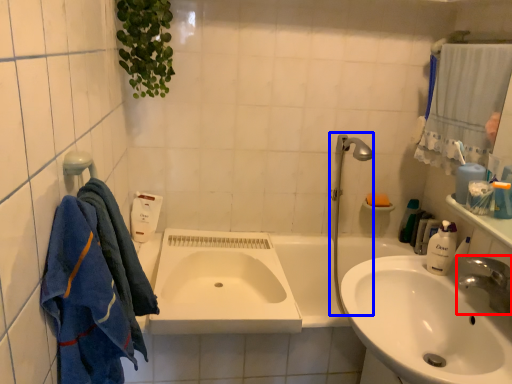
Question: Which object is further to the camera taking this photo, tap (highlighted by a red box) or plumbing fixture (highlighted by a blue box)?

Choices:
 (A) tap
 (B) plumbing fixture

Answer: (B)